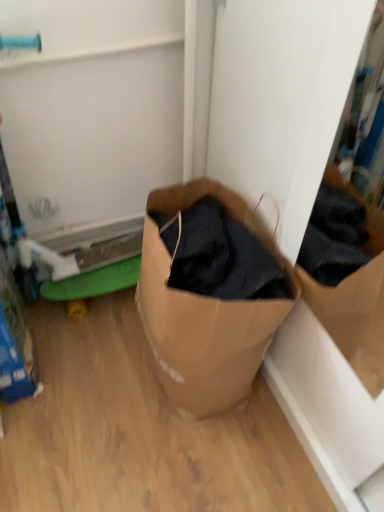
Locate an element on the screen. This screenshot has width=384, height=512. green rubber toy at lower left is located at coordinates (93, 282).

This screenshot has height=512, width=384. What do you see at coordinates (93, 282) in the screenshot?
I see `green rubber toy at lower left` at bounding box center [93, 282].

What is the approximate height of green rubber toy at lower left?

The height of green rubber toy at lower left is 3.96 inches.

What is the approximate width of brown paper bag at center?

brown paper bag at center is 33.88 centimeters wide.

At what (x,y) coordinates should I click in order to perform the action: click on brown paper bag at center. Please return your answer as a coordinate pair (x, y). Looking at the image, I should click on (205, 313).

Describe the element at coordinates (205, 313) in the screenshot. I see `brown paper bag at center` at that location.

Image resolution: width=384 pixels, height=512 pixels. What are the coordinates of `green rubber toy at lower left` in the screenshot? It's located at (93, 282).

Based on the photo, which is more to the right, brown paper bag at center or green rubber toy at lower left?

Positioned to the right is brown paper bag at center.

Considering the positions of objects brown paper bag at center and green rubber toy at lower left in the image provided, who is in front, brown paper bag at center or green rubber toy at lower left?

brown paper bag at center is closer to the camera.

Which point is more distant from viewer, (188, 387) or (108, 284)?

The point (108, 284) is behind.

From the image's perspective, which object appears higher, brown paper bag at center or green rubber toy at lower left?

brown paper bag at center.

From a real-world perspective, between brown paper bag at center and green rubber toy at lower left, who is vertically higher?

brown paper bag at center.

Considering the sizes of objects brown paper bag at center and green rubber toy at lower left in the image provided, who is thinner, brown paper bag at center or green rubber toy at lower left?

With smaller width is green rubber toy at lower left.

Considering the relative sizes of brown paper bag at center and green rubber toy at lower left in the image provided, is brown paper bag at center shorter than green rubber toy at lower left?

In fact, brown paper bag at center may be taller than green rubber toy at lower left.

Between brown paper bag at center and green rubber toy at lower left, which one has smaller size?

green rubber toy at lower left.

Would you say brown paper bag at center is inside or outside green rubber toy at lower left?

brown paper bag at center lies outside green rubber toy at lower left.

Is brown paper bag at center not near green rubber toy at lower left?

Actually, brown paper bag at center and green rubber toy at lower left are a little close together.

Could you tell me if brown paper bag at center is turned towards green rubber toy at lower left?

No, brown paper bag at center is not oriented towards green rubber toy at lower left.

Can you tell me how much brown paper bag at center and green rubber toy at lower left differ in facing direction?

brown paper bag at center and green rubber toy at lower left are facing 86.4 degrees away from each other.

How distant is brown paper bag at center from green rubber toy at lower left?

brown paper bag at center and green rubber toy at lower left are 15.31 inches apart.

Where is `toy on the left of brown paper bag at center`? The image size is (384, 512). toy on the left of brown paper bag at center is located at coordinates (93, 282).

Between green rubber toy at lower left and brown paper bag at center, which one appears on the left side from the viewer's perspective?

Positioned to the left is green rubber toy at lower left.

Based on the photo, which object is closer to the camera taking this photo, green rubber toy at lower left or brown paper bag at center?

Positioned in front is brown paper bag at center.

From the picture: Which is farther, [45,298] or [249,375]?

The point [45,298] is behind.

From the image's perspective, would you say green rubber toy at lower left is positioned over brown paper bag at center?

Actually, green rubber toy at lower left appears below brown paper bag at center in the image.

From a real-world perspective, which object rests below the other?

green rubber toy at lower left, from a real-world perspective.

Does green rubber toy at lower left have a greater width compared to brown paper bag at center?

In fact, green rubber toy at lower left might be narrower than brown paper bag at center.

From their relative heights in the image, would you say green rubber toy at lower left is taller or shorter than brown paper bag at center?

Considering their sizes, green rubber toy at lower left has less height than brown paper bag at center.

Considering the sizes of green rubber toy at lower left and brown paper bag at center in the image, is green rubber toy at lower left bigger or smaller than brown paper bag at center?

Clearly, green rubber toy at lower left is smaller in size than brown paper bag at center.

Is brown paper bag at center located within green rubber toy at lower left?

No, brown paper bag at center is not surrounded by green rubber toy at lower left.

Are green rubber toy at lower left and brown paper bag at center far apart?

No, there isn't a large distance between green rubber toy at lower left and brown paper bag at center.

Is green rubber toy at lower left positioned with its back to brown paper bag at center?

No, green rubber toy at lower left is not facing the opposite direction of brown paper bag at center.

Can you tell me how much green rubber toy at lower left and brown paper bag at center differ in facing direction?

The facing directions of green rubber toy at lower left and brown paper bag at center are 86.4 degrees apart.

The image size is (384, 512). In order to click on box above the green rubber toy at lower left (from the image's perspective) in this screenshot , I will do `click(205, 313)`.

There is a green rubber toy at lower left. Identify the location of box above it (from a real-world perspective). This screenshot has height=512, width=384. (205, 313).

Identify the location of toy below the brown paper bag at center (from a real-world perspective). (93, 282).